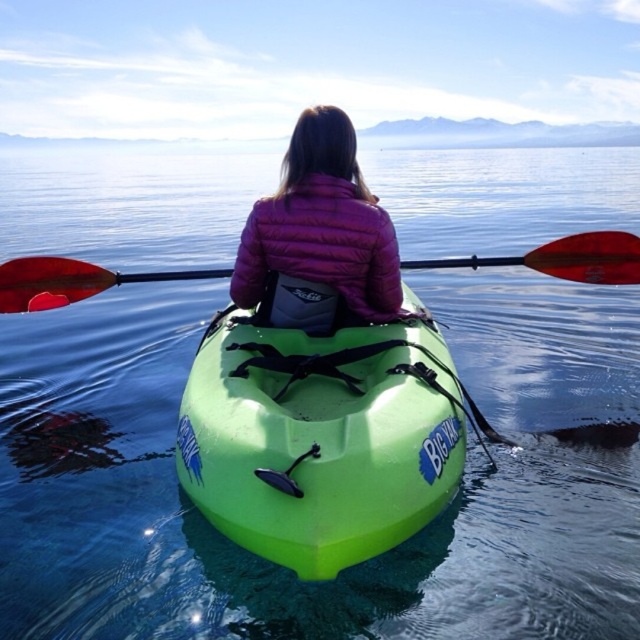
Question: Considering the relative positions of purple puffy jacket at center and red plastic paddle at center in the image provided, where is purple puffy jacket at center located with respect to red plastic paddle at center?

Choices:
 (A) right
 (B) left

Answer: (B)

Question: Can you confirm if green plastic canoe at center is bigger than red plastic paddle at center?

Choices:
 (A) yes
 (B) no

Answer: (A)

Question: Which point is farther from the camera taking this photo?

Choices:
 (A) (324, 120)
 (B) (285, 388)
 (C) (618, 230)

Answer: (C)

Question: Which of the following is the farthest from the observer?

Choices:
 (A) purple puffy jacket at center
 (B) red plastic paddle at center
 (C) green plastic canoe at center

Answer: (B)

Question: Which object is positioned closest to the red plastic paddle at center?

Choices:
 (A) green plastic canoe at center
 (B) purple puffy jacket at center

Answer: (B)

Question: Is green plastic canoe at center positioned before purple puffy jacket at center?

Choices:
 (A) no
 (B) yes

Answer: (B)